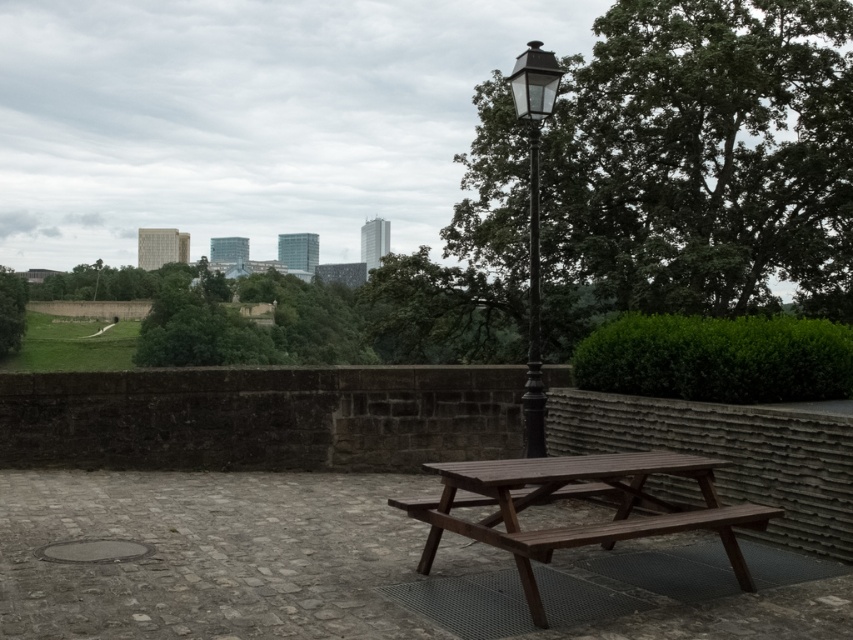
Question: Which of the following is the closest to the observer?

Choices:
 (A) green leafy tree at upper right
 (B) brown wooden table at center
 (C) black metal lamp post at center

Answer: (B)

Question: Is green leafy tree at upper right to the left of black metal lamp post at center from the viewer's perspective?

Choices:
 (A) yes
 (B) no

Answer: (B)

Question: Which point is closer to the camera?

Choices:
 (A) (532, 320)
 (B) (611, 488)
 (C) (601, 148)

Answer: (B)

Question: Considering the real-world distances, which object is closest to the black metal lamp post at center?

Choices:
 (A) brown wooden table at center
 (B) green leafy tree at upper right

Answer: (A)

Question: Observing the image, what is the correct spatial positioning of green leafy tree at upper right in reference to brown wooden table at center?

Choices:
 (A) above
 (B) below

Answer: (A)

Question: Does green leafy tree at upper right have a greater width compared to brown wooden table at center?

Choices:
 (A) no
 (B) yes

Answer: (B)